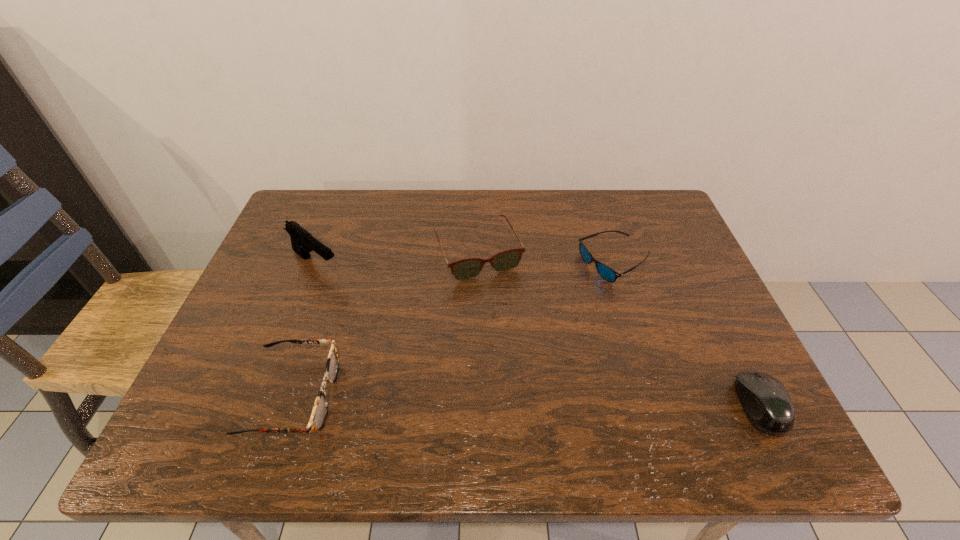
What are the coordinates of `free spot between the fourth object from left to right and the left spectacles` in the screenshot? It's located at (453, 330).

Where is `free space between the left spectacles and the shortest object`? free space between the left spectacles and the shortest object is located at coordinates (453, 330).

The image size is (960, 540). Find the location of `object that stands as the third closest to the shortest object`. object that stands as the third closest to the shortest object is located at coordinates (320, 409).

Locate an element on the screen. Image resolution: width=960 pixels, height=540 pixels. object that is the fourth nearest to the mouse is located at coordinates coord(302,241).

Locate an element on the screen. blank area in the image that satisfies the following two spatial constraints: 1. on the front side of the tallest object; 2. on the frame of the nearer spectacles is located at coordinates (266, 396).